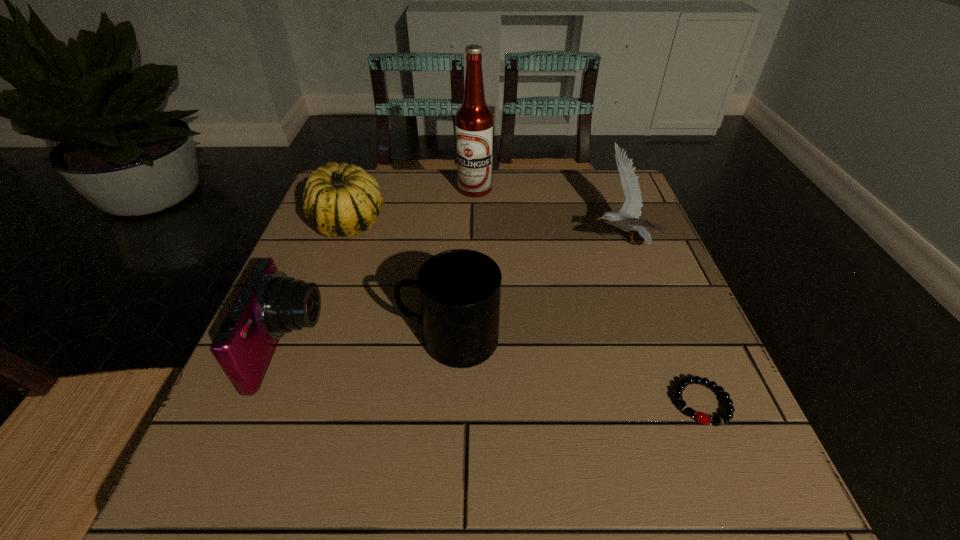
Identify the location of gourd present at the left edge. This screenshot has height=540, width=960. (339, 200).

Locate an element on the screen. This screenshot has width=960, height=540. camera situated at the left edge is located at coordinates (270, 304).

The height and width of the screenshot is (540, 960). I want to click on gull positioned at the right edge, so click(x=627, y=219).

I want to click on bracelet that is at the right edge, so click(701, 417).

Locate an element on the screen. The height and width of the screenshot is (540, 960). object that is at the far left corner is located at coordinates (339, 200).

This screenshot has height=540, width=960. Identify the location of object located in the far right corner section of the desktop. (627, 219).

This screenshot has width=960, height=540. Identify the location of free space at the far edge of the desktop. (426, 172).

Locate an element on the screen. The height and width of the screenshot is (540, 960). vacant space at the near edge of the desktop is located at coordinates (484, 457).

In the image, there is a desktop. Find the location of `vacant space at the left edge`. vacant space at the left edge is located at coordinates (329, 382).

In the image, there is a desktop. What are the coordinates of `vacant space at the right edge` in the screenshot? It's located at (708, 369).